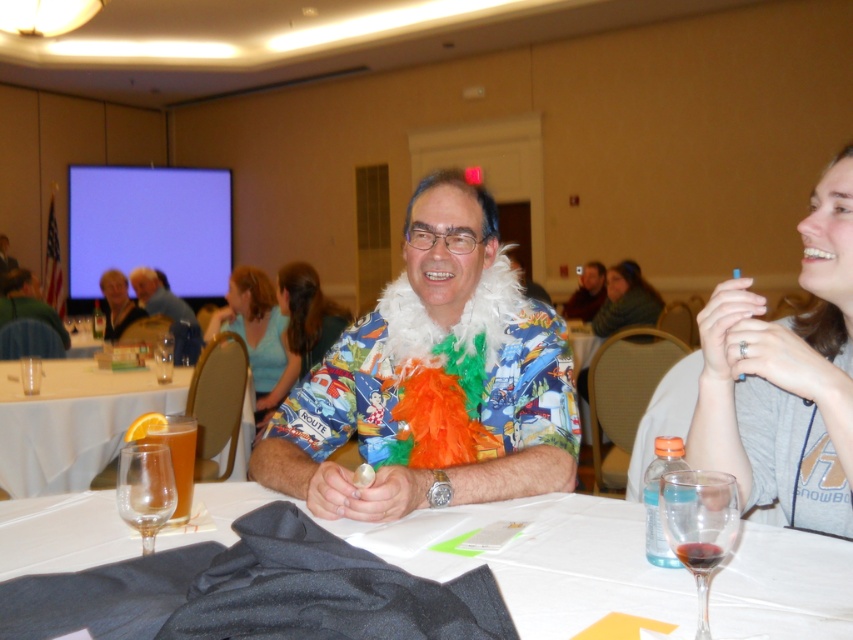
Question: Is gray cotton t-shirt at upper right positioned before white plastic table at lower left?

Choices:
 (A) yes
 (B) no

Answer: (A)

Question: Is silky black fabric at center closer to the viewer compared to gray cotton t-shirt at upper right?

Choices:
 (A) no
 (B) yes

Answer: (B)

Question: Which object appears farthest from the camera in this image?

Choices:
 (A) transparent glass at table front
 (B) white plastic table at lower left
 (C) blue fabric shirt at center

Answer: (C)

Question: Can you confirm if blue cotton shirt at center is wider than transparent glass at table front?

Choices:
 (A) yes
 (B) no

Answer: (A)

Question: Which point is closer to the camera?

Choices:
 (A) hawaiian shirt at center
 (B) green fuzzy sweater at upper right

Answer: (A)

Question: Which point is farther to the camera?

Choices:
 (A) hawaiian shirt at center
 (B) printed fabric shirt at center

Answer: (B)